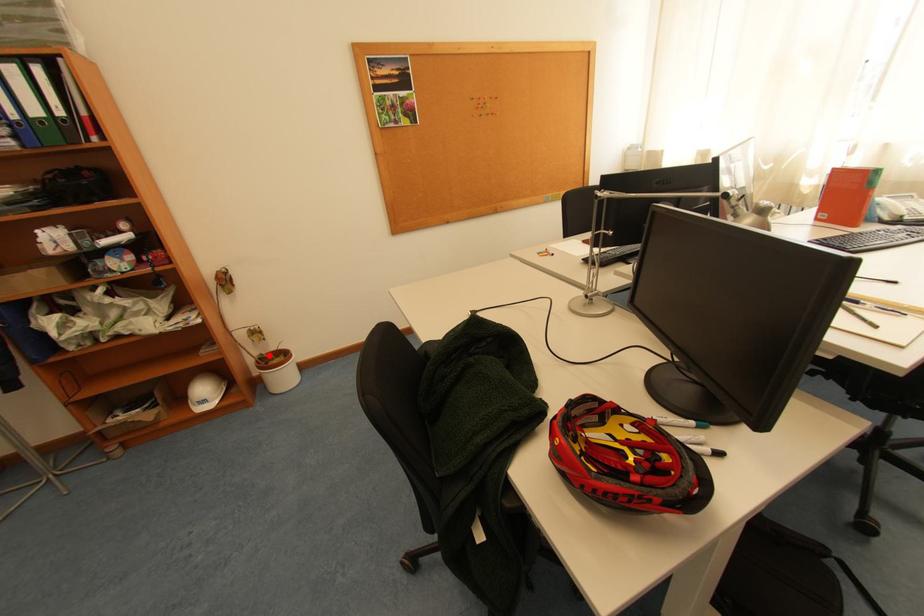
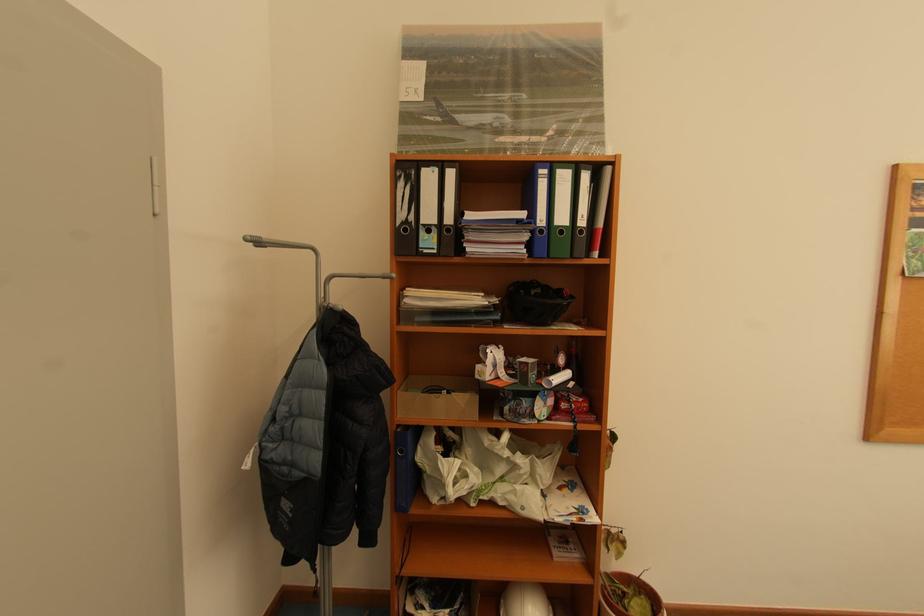
Find the pixel in the second image that matches the highlighted location in the first image.

(614, 576)